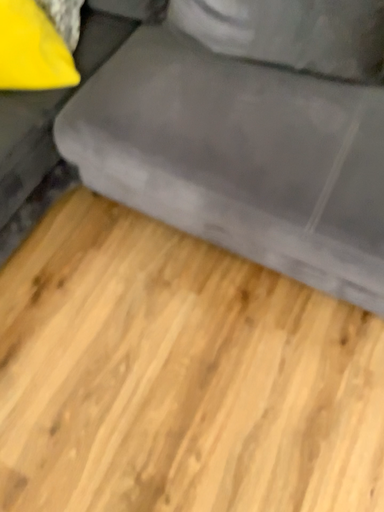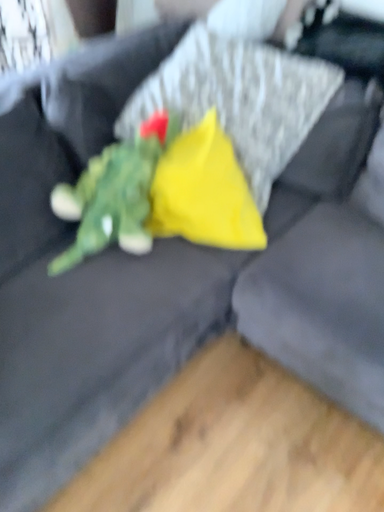
Question: How did the camera likely rotate when shooting the video?

Choices:
 (A) rotated right
 (B) rotated left

Answer: (B)